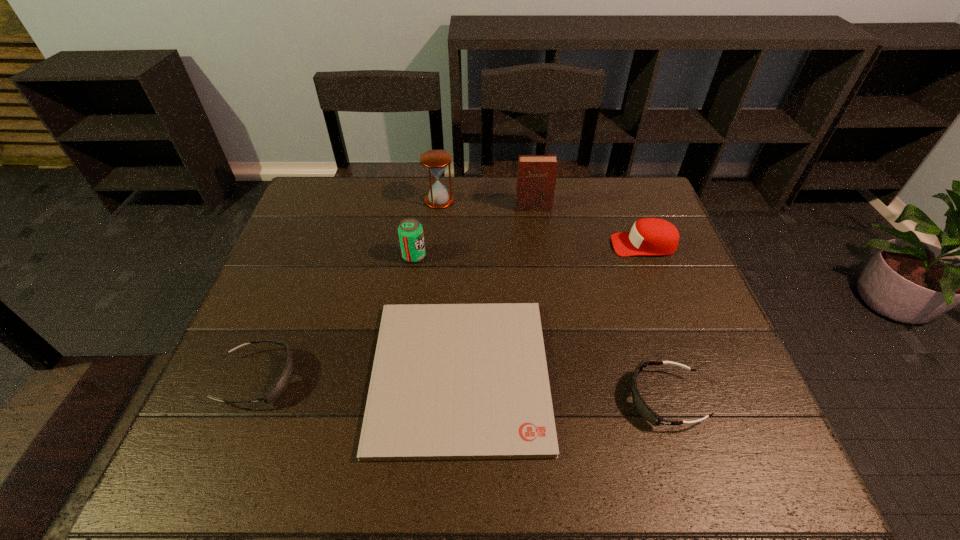
At what (x,y) coordinates should I click in order to perform the action: click on object that is at the near edge. Please return your answer as a coordinate pair (x, y). This screenshot has height=540, width=960. Looking at the image, I should click on (449, 381).

This screenshot has width=960, height=540. What are the coordinates of `object present at the left edge` in the screenshot? It's located at (281, 384).

At what (x,y) coordinates should I click in order to perform the action: click on baseball cap located at the right edge. Please return your answer as a coordinate pair (x, y). Looking at the image, I should click on (649, 236).

I want to click on goggles present at the right edge, so click(645, 411).

Find the location of a particular element. The height and width of the screenshot is (540, 960). vacant region at the far edge of the desktop is located at coordinates (408, 177).

Locate an element on the screen. Image resolution: width=960 pixels, height=540 pixels. vacant area at the near edge is located at coordinates (614, 474).

At what (x,y) coordinates should I click in order to perform the action: click on blank area at the left edge. Please return your answer as a coordinate pair (x, y). Looking at the image, I should click on (314, 251).

Image resolution: width=960 pixels, height=540 pixels. Find the location of `vacant point at the right edge`. vacant point at the right edge is located at coordinates (708, 356).

In the image, there is a desktop. In order to click on vacant space at the near right corner in this screenshot , I will do click(x=699, y=442).

Locate an element on the screen. vacant region between the hourglass and the leftmost object is located at coordinates (348, 289).